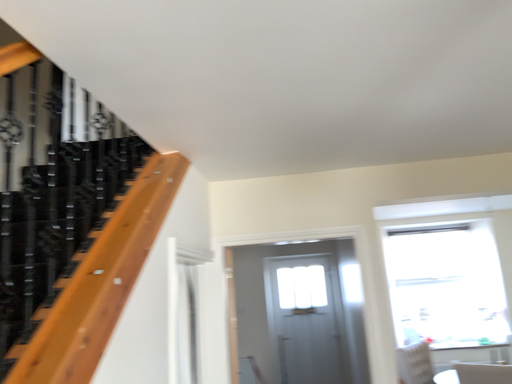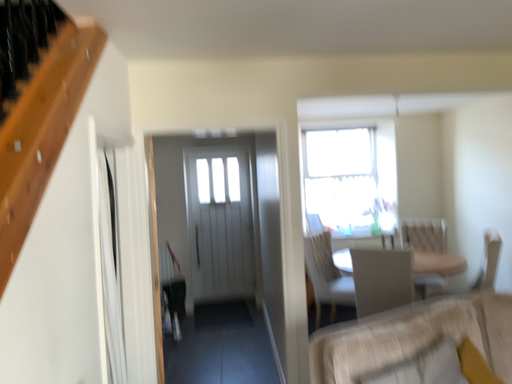
Question: How did the camera likely rotate when shooting the video?

Choices:
 (A) rotated left
 (B) rotated right

Answer: (B)